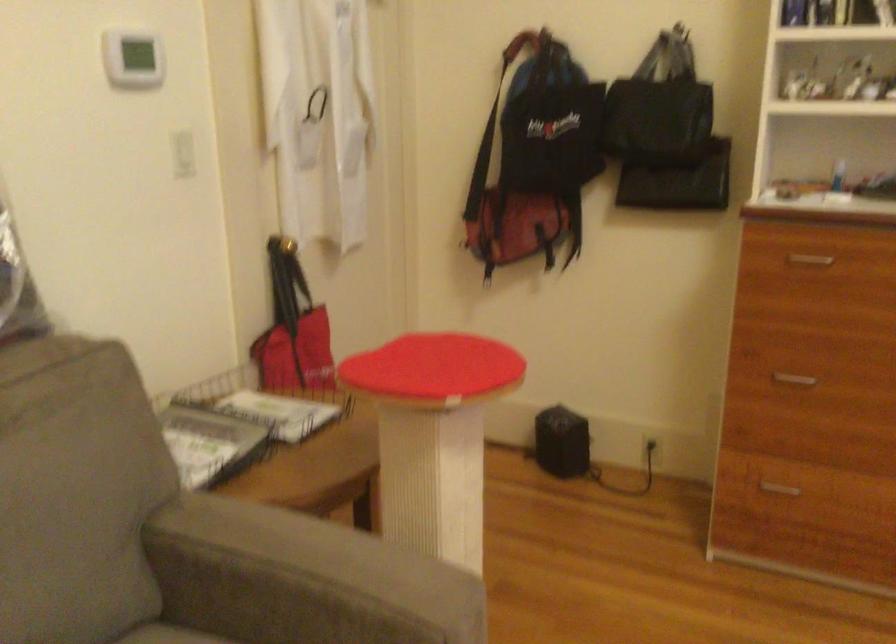
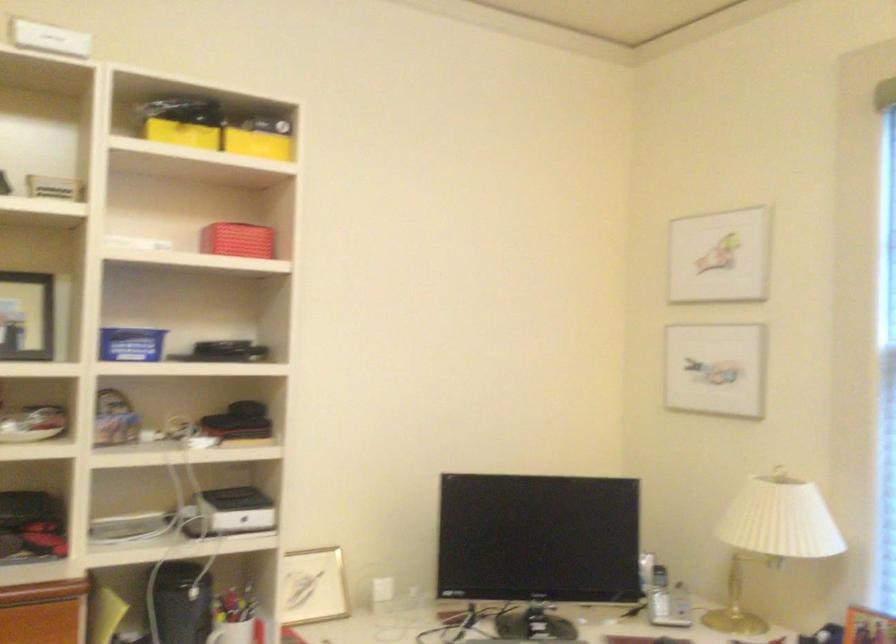
Question: The camera is either moving clockwise (left) or counter-clockwise (right) around the object. The first image is from the beginning of the video and the second image is from the end. Is the camera moving left or right when shooting the video?

Choices:
 (A) Left
 (B) Right

Answer: (A)